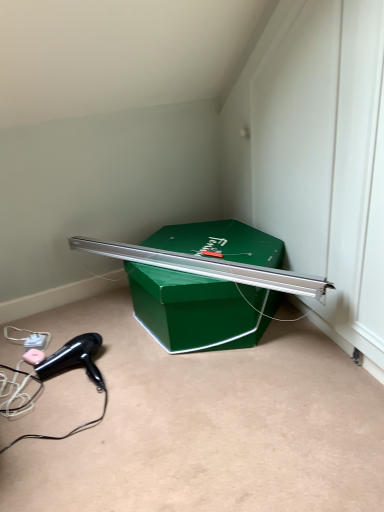
You are a GUI agent. You are given a task and a screenshot of the screen. Output one action in this format:
    pyautogui.click(x=<x>, y=<y>)
    Task: Click on the vacant space situated on the left part of green matte box at center
    The image size is (384, 512).
    Given the screenshot: What is the action you would take?
    coord(78,333)